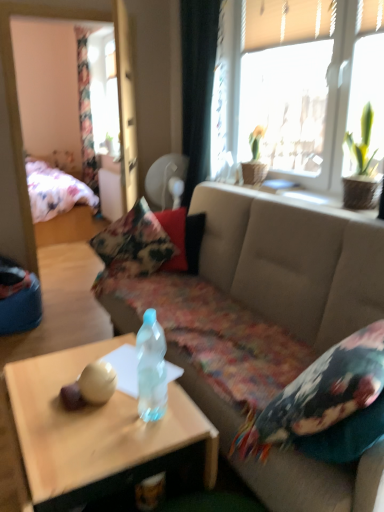
This screenshot has height=512, width=384. I want to click on unoccupied region to the right of translucent plastic bottle at center, so click(187, 417).